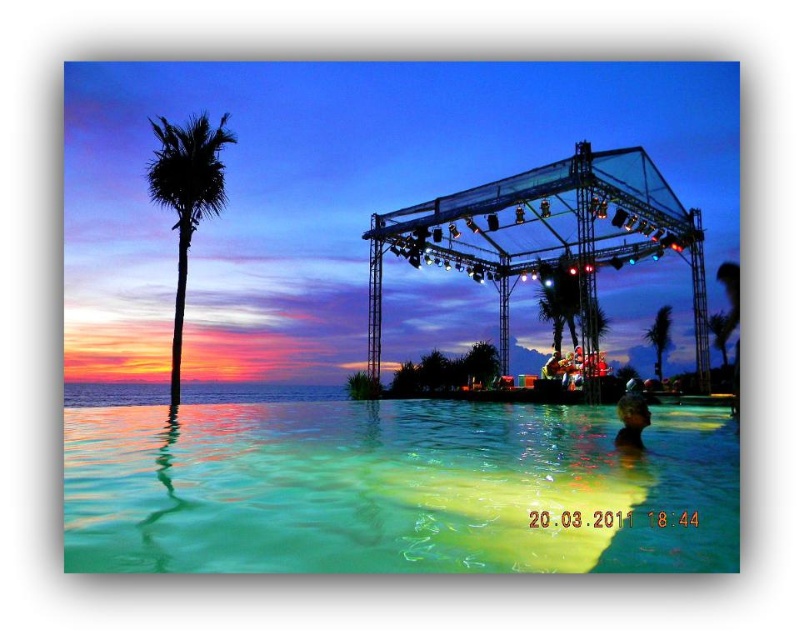
Does black silhouette palm tree at left come behind green leafy palm tree at center?

No, it is not.

Looking at this image, does black silhouette palm tree at left appear over green leafy palm tree at center?

Correct, black silhouette palm tree at left is located above green leafy palm tree at center.

Does point (156, 188) come closer to viewer compared to point (651, 324)?

Yes, point (156, 188) is in front of point (651, 324).

The height and width of the screenshot is (640, 804). In order to click on black silhouette palm tree at left in this screenshot , I will do `click(187, 196)`.

Based on the photo, who is higher up, green translucent water at center or green leafy palm tree at center?

green leafy palm tree at center is above.

Can you confirm if green translucent water at center is positioned below green leafy palm tree at center?

Yes, green translucent water at center is below green leafy palm tree at center.

Describe the element at coordinates (396, 490) in the screenshot. I see `green translucent water at center` at that location.

Identify the location of green translucent water at center. (396, 490).

Which is more to the left, green translucent water at center or black silhouette palm tree at left?

black silhouette palm tree at left is more to the left.

Describe the element at coordinates (396, 490) in the screenshot. I see `green translucent water at center` at that location.

The image size is (804, 640). I want to click on green translucent water at center, so click(x=396, y=490).